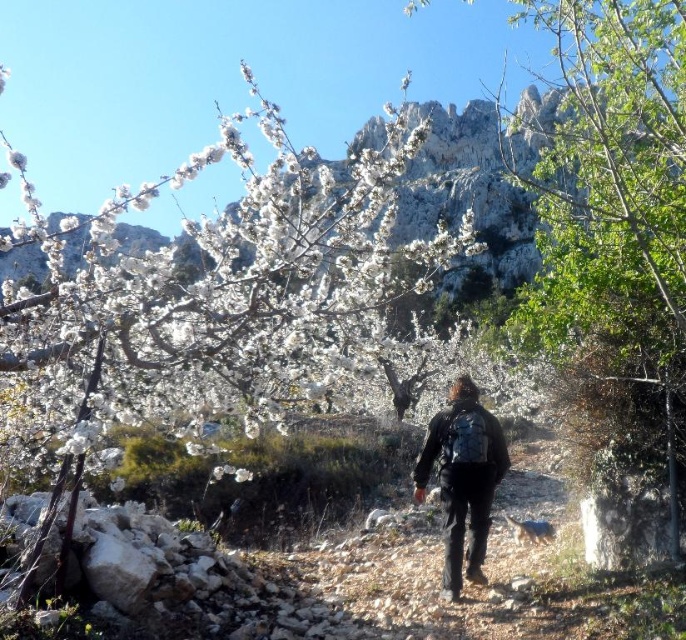
Is white fluffy blossoms at upper left bigger than black matte backpack at center?

Result: Yes.

Is point (200, 276) more distant than point (456, 564)?

Yes, it is behind point (456, 564).

Image resolution: width=686 pixels, height=640 pixels. Identify the location of white fluffy blossoms at upper left. (236, 296).